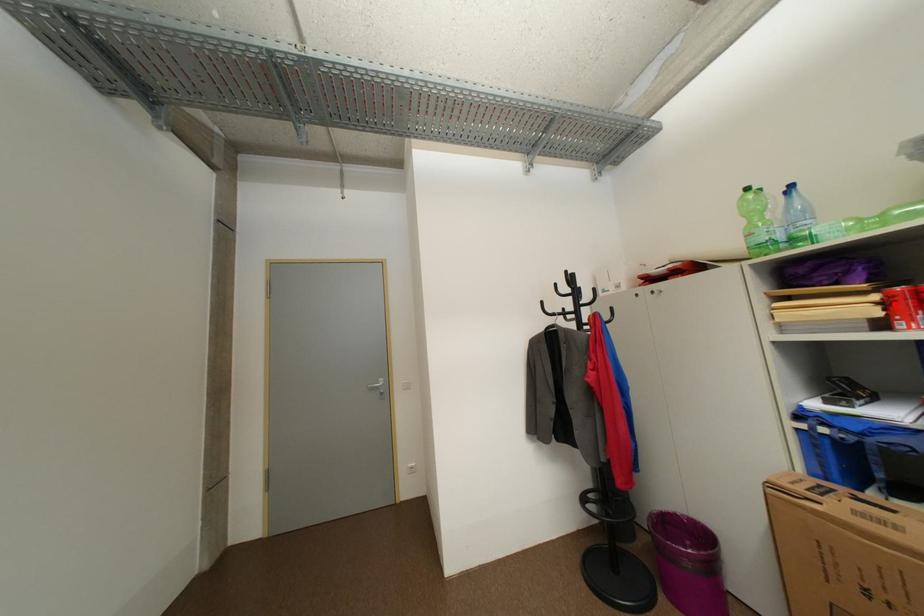
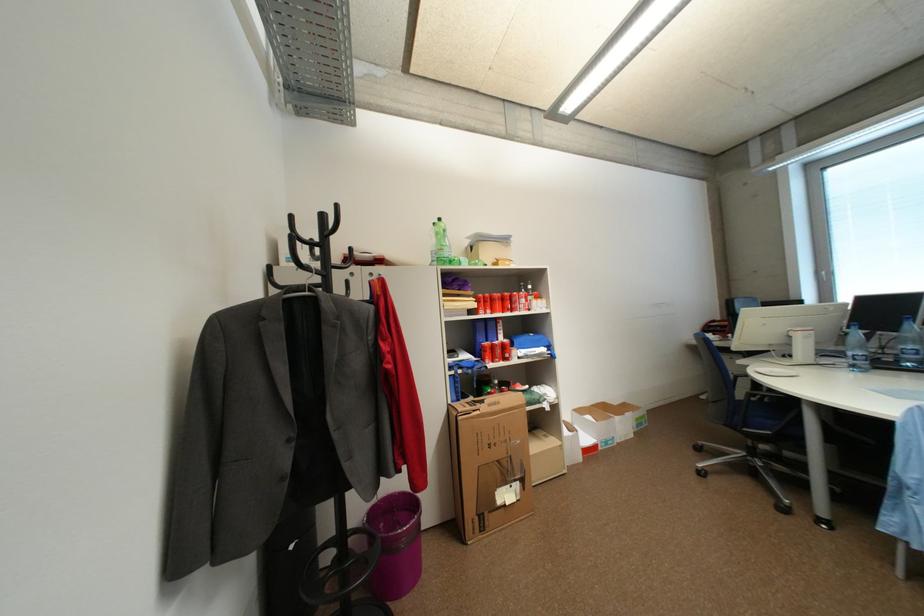
The point at the highlighted location is marked in the first image. Where is the corresponding point in the second image?

(485, 302)